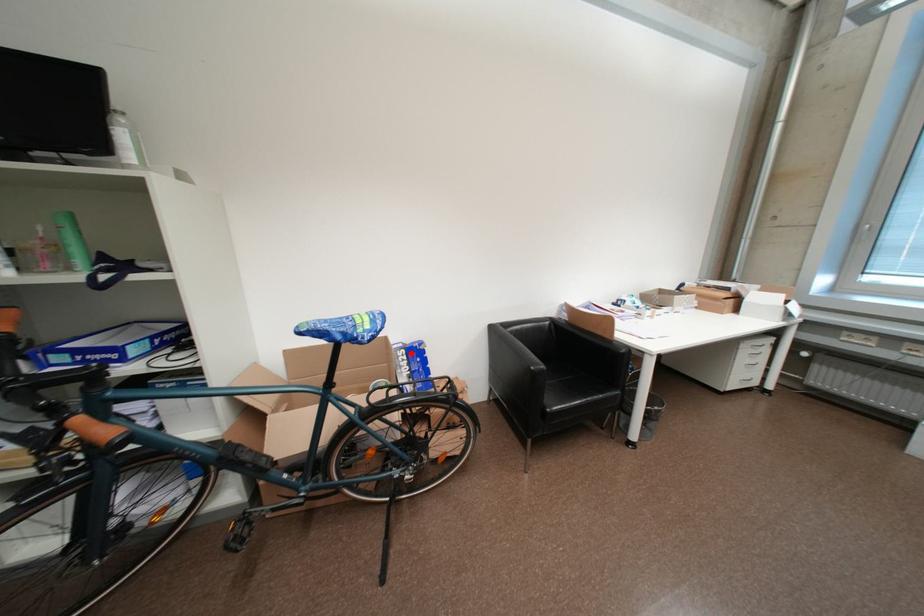
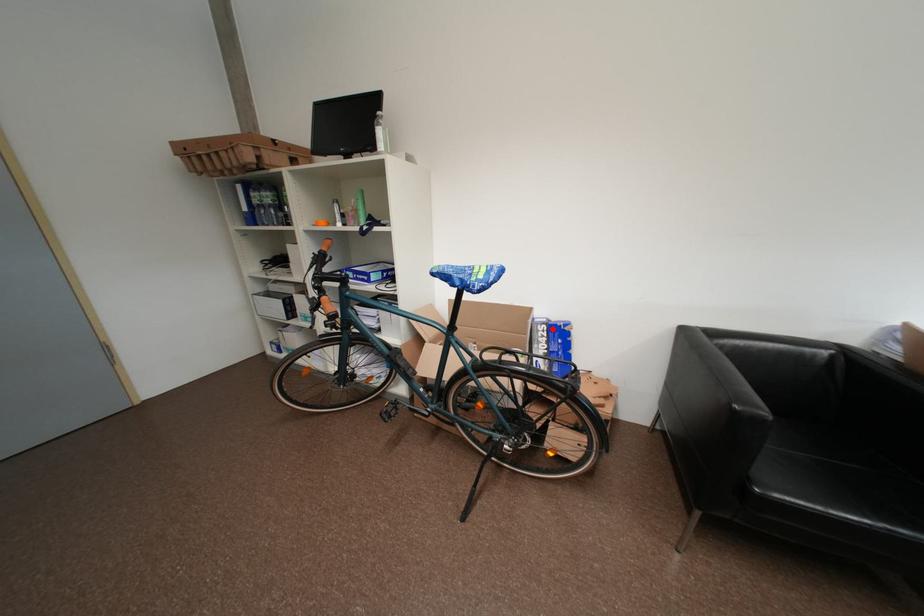
I am providing you with two images of the same scene from different viewpoints. A red point is marked on the first image and another point is marked on the second image. Is the marked point in image1 the same physical position as the marked point in image2?

Yes